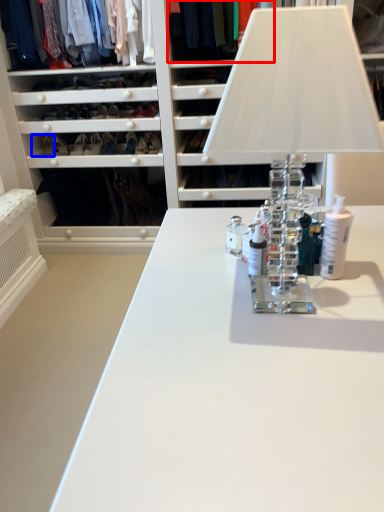
Question: Which point is closer to the camera, clothing (highlighted by a red box) or shoe (highlighted by a blue box)?

Choices:
 (A) clothing
 (B) shoe

Answer: (A)